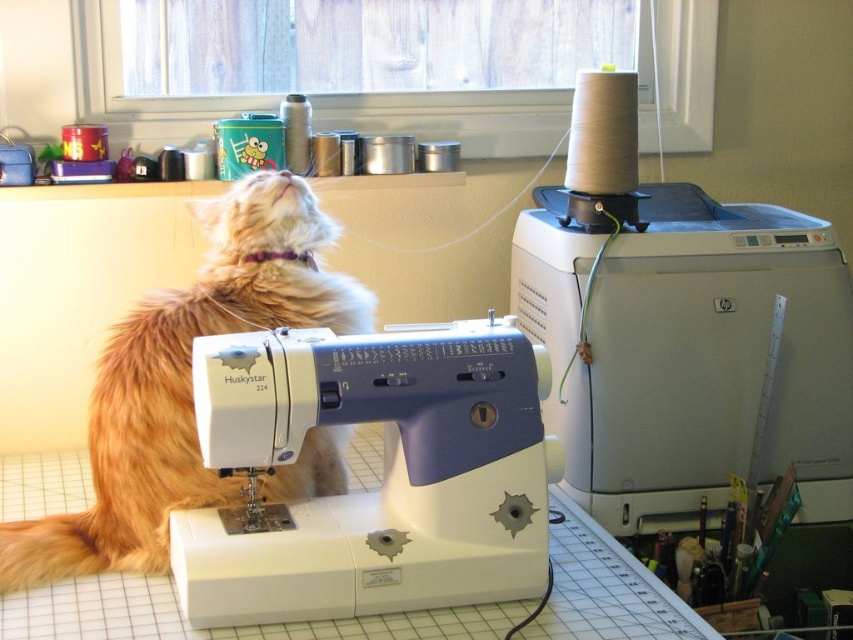
Question: Is white plastic sewing machine at upper right wider than fluffy orange cat at center?

Choices:
 (A) yes
 (B) no

Answer: (A)

Question: Which point appears farthest from the camera in this image?

Choices:
 (A) (219, 316)
 (B) (369, 541)

Answer: (A)

Question: Among these points, which one is farthest from the camera?

Choices:
 (A) (233, 376)
 (B) (16, 520)
 (C) (601, 273)

Answer: (C)

Question: Does white plastic sewing machine at upper right have a larger size compared to fluffy orange cat at center?

Choices:
 (A) no
 (B) yes

Answer: (A)

Question: Can you confirm if white plastic sewing machine at upper right is positioned below fluffy orange cat at center?

Choices:
 (A) yes
 (B) no

Answer: (B)

Question: Which object is the closest to the fluffy orange cat at center?

Choices:
 (A) white plastic sewing machine at upper right
 (B) white plastic sewing machine at center

Answer: (B)